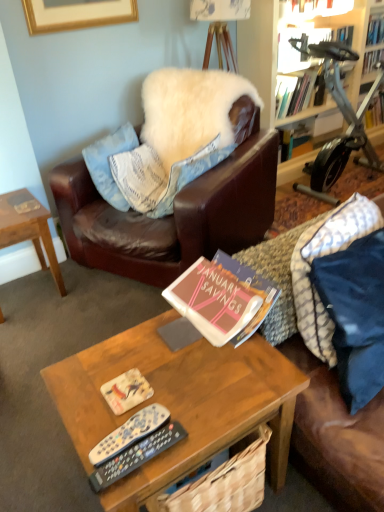
Locate an element on the screen. The width and height of the screenshot is (384, 512). vacant space situated on the left part of matte paper book cover at center is located at coordinates (85, 390).